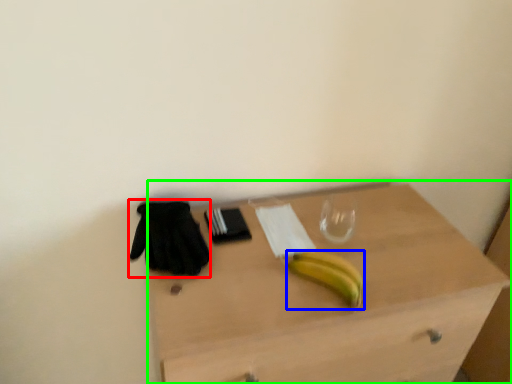
Question: Which is farther away from glove (highlighted by a red box)? banana (highlighted by a blue box) or desk (highlighted by a green box)?

Choices:
 (A) banana
 (B) desk

Answer: (B)